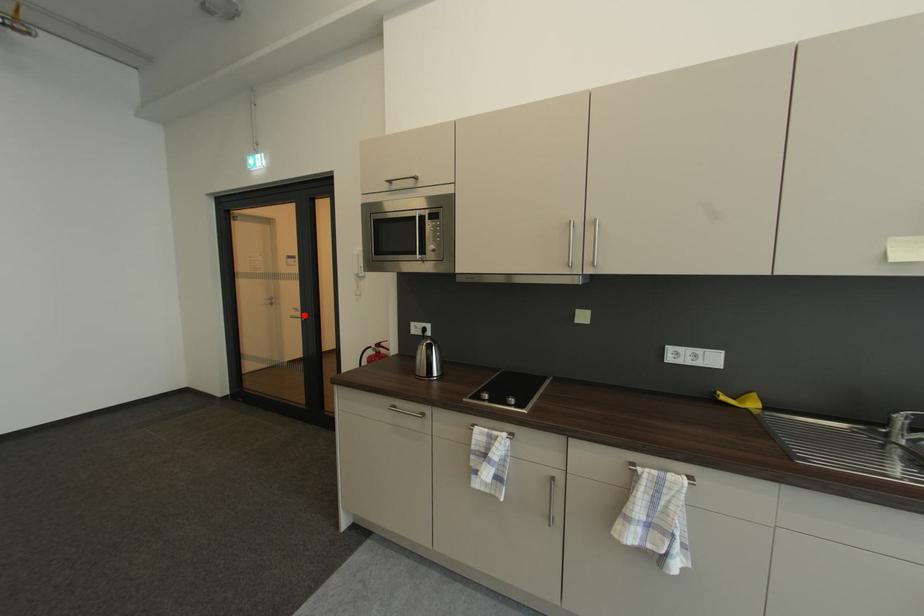
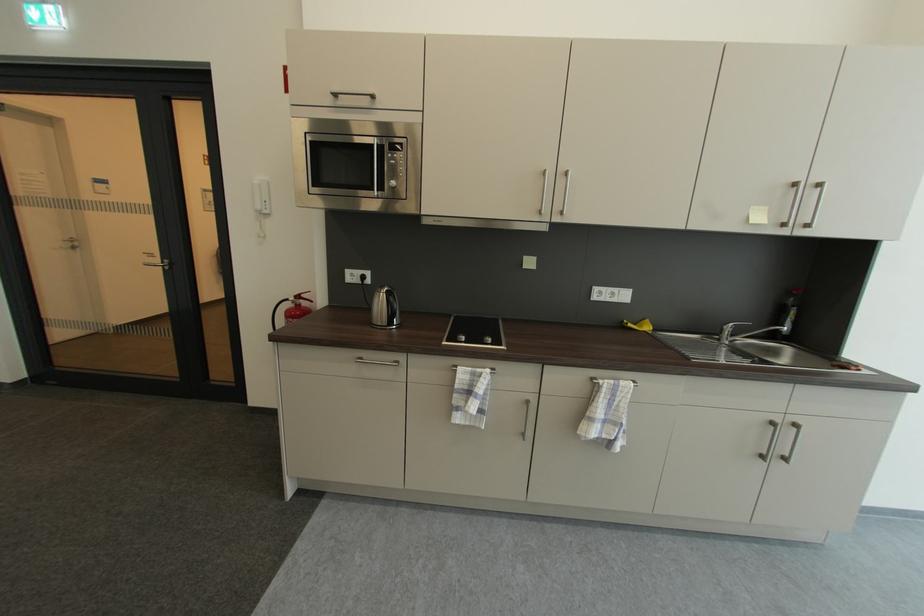
The point at the highlighted location is marked in the first image. Where is the corresponding point in the second image?

(163, 262)